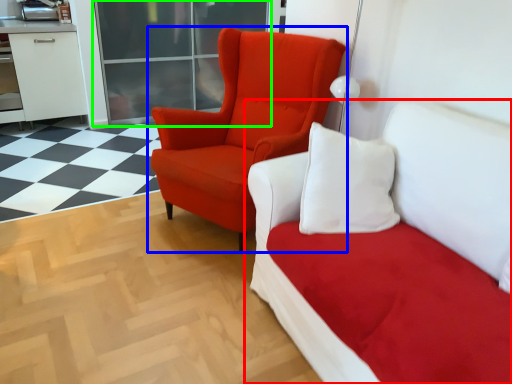
Question: Which is nearer to the studio couch (highlighted by a red box)? chair (highlighted by a blue box) or glass door (highlighted by a green box).

Choices:
 (A) chair
 (B) glass door

Answer: (A)